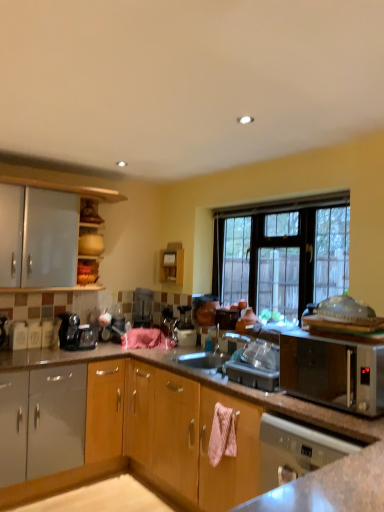
Question: From a real-world perspective, does metallic silver toaster at center sit lower than silver metallic microwave at right?

Choices:
 (A) yes
 (B) no

Answer: (B)

Question: Considering the relative sizes of metallic silver toaster at center and silver metallic microwave at right in the image provided, is metallic silver toaster at center bigger than silver metallic microwave at right?

Choices:
 (A) no
 (B) yes

Answer: (A)

Question: Is metallic silver toaster at center in front of silver metallic microwave at right?

Choices:
 (A) no
 (B) yes

Answer: (A)

Question: Is metallic silver toaster at center far from silver metallic microwave at right?

Choices:
 (A) yes
 (B) no

Answer: (A)

Question: Could you tell me if metallic silver toaster at center is turned towards silver metallic microwave at right?

Choices:
 (A) no
 (B) yes

Answer: (A)

Question: Can you confirm if metallic silver toaster at center is smaller than silver metallic microwave at right?

Choices:
 (A) no
 (B) yes

Answer: (B)

Question: Is silver metallic microwave at right positioned far away from black glass window at center?

Choices:
 (A) yes
 (B) no

Answer: (A)

Question: Does silver metallic microwave at right lie behind black glass window at center?

Choices:
 (A) no
 (B) yes

Answer: (A)

Question: Can you confirm if silver metallic microwave at right is smaller than black glass window at center?

Choices:
 (A) yes
 (B) no

Answer: (A)

Question: Can you confirm if silver metallic microwave at right is bigger than black glass window at center?

Choices:
 (A) yes
 (B) no

Answer: (B)

Question: Is black glass window at center a part of silver metallic microwave at right?

Choices:
 (A) no
 (B) yes

Answer: (A)

Question: Considering the relative positions of silver metallic microwave at right and black glass window at center in the image provided, is silver metallic microwave at right in front of black glass window at center?

Choices:
 (A) no
 (B) yes

Answer: (B)

Question: Considering the relative sizes of satin silver dishwasher at lower right and black glass window at center in the image provided, is satin silver dishwasher at lower right shorter than black glass window at center?

Choices:
 (A) no
 (B) yes

Answer: (B)